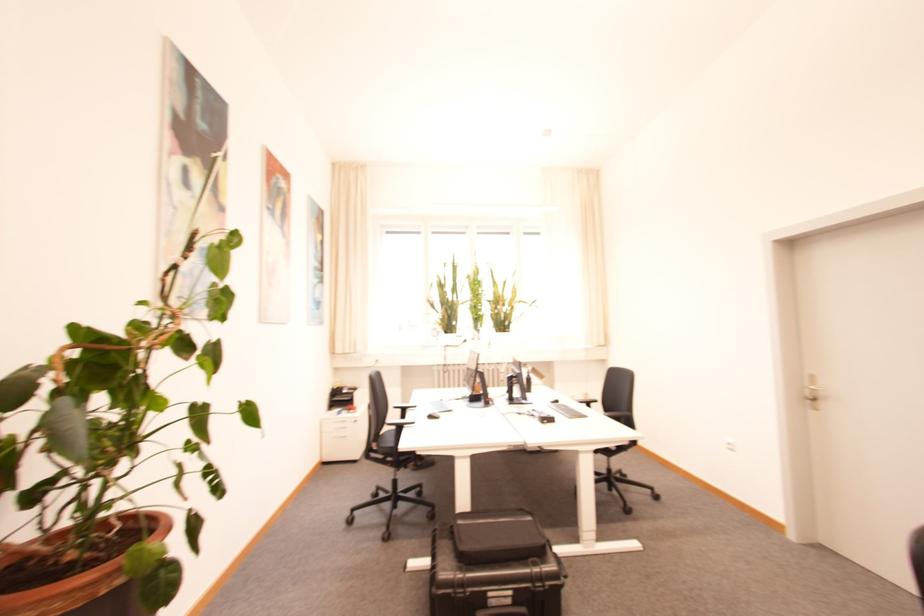
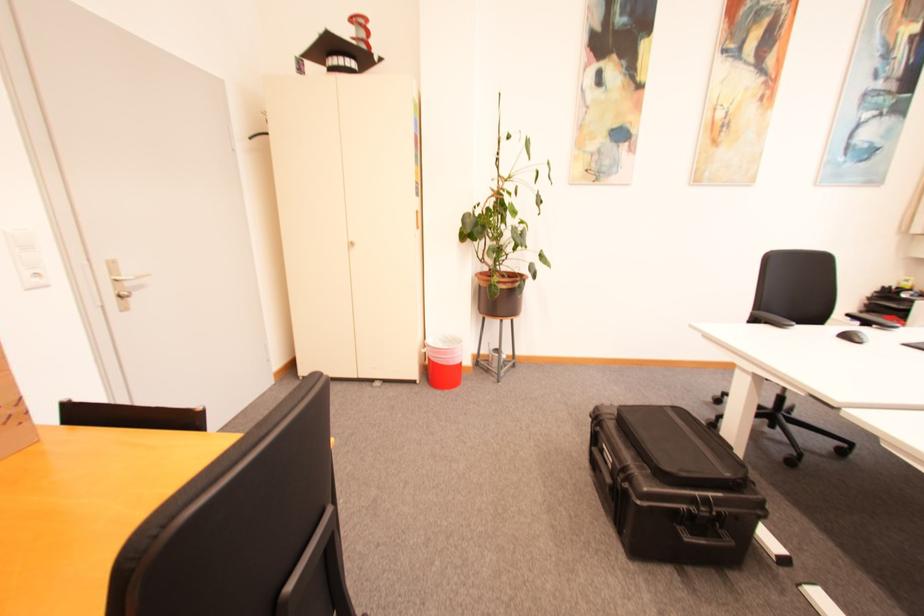
Find the pixel in the second image that matches point (168, 572) in the first image.

(500, 286)